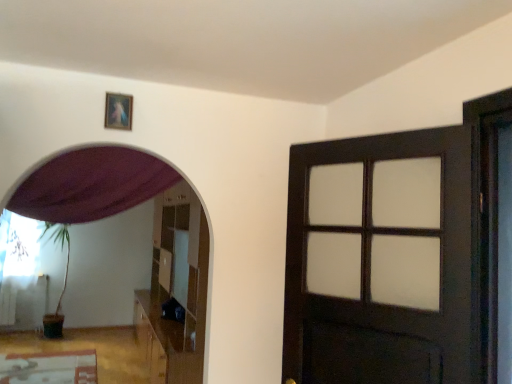
Question: In terms of width, does wooden picture frame at upper center look wider or thinner when compared to white sheer curtain at left, which is counted as the second curtain, starting from the top?

Choices:
 (A) thin
 (B) wide

Answer: (B)

Question: Is point (128, 117) positioned closer to the camera than point (25, 244)?

Choices:
 (A) farther
 (B) closer

Answer: (B)

Question: Considering the real-world distances, which object is closest to the glossy wooden dresser at center?

Choices:
 (A) white sheer curtain at left, which is the first curtain in bottom-to-top order
 (B) dark wood door at right
 (C) wooden picture frame at upper center
 (D) purple fabric curtain at upper left, which ranks as the 1th curtain in right-to-left order

Answer: (D)

Question: Estimate the real-world distances between objects in this image. Which object is farther from the purple fabric curtain at upper left, the 1th curtain positioned from the top?

Choices:
 (A) white sheer curtain at left, which is counted as the second curtain, starting from the top
 (B) dark wood door at right
 (C) wooden picture frame at upper center
 (D) glossy wooden dresser at center

Answer: (A)